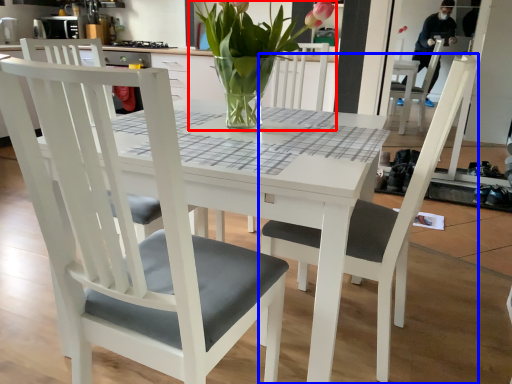
Question: Which of the following is the farthest to the observer, houseplant (highlighted by a red box) or chair (highlighted by a blue box)?

Choices:
 (A) houseplant
 (B) chair

Answer: (A)